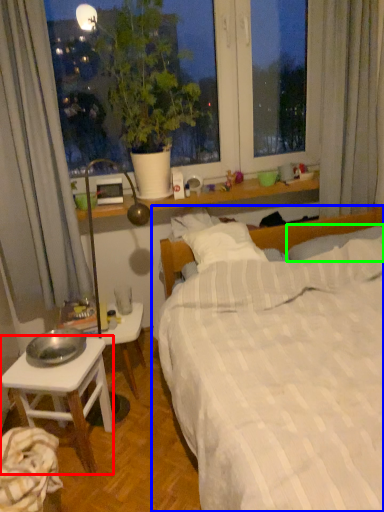
Question: Based on their relative distances, which object is nearer to desk (highlighted by a red box)? Choose from bed (highlighted by a blue box) and pillow (highlighted by a green box).

Choices:
 (A) bed
 (B) pillow

Answer: (A)